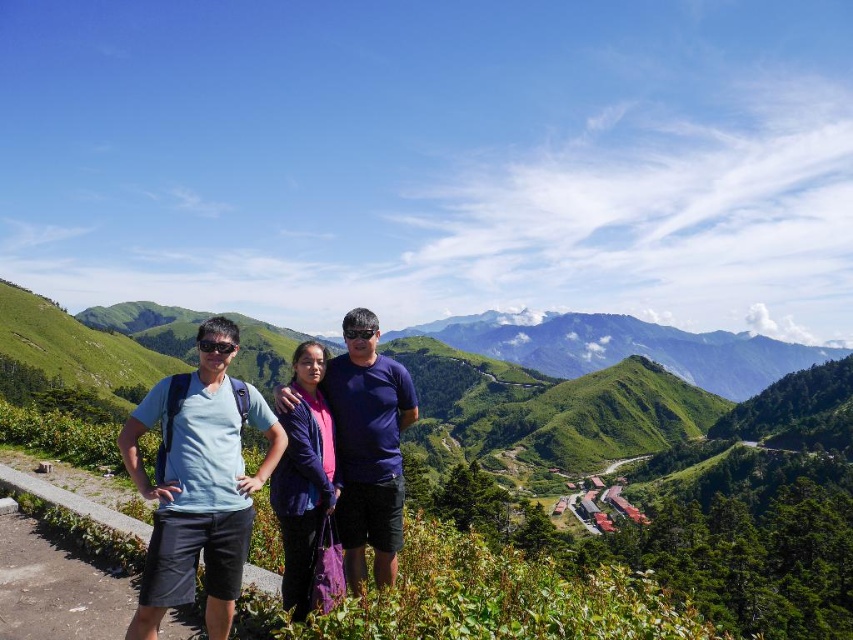
From the picture: Measure the distance between point (346, 454) and camera.

They are 23.25 meters apart.

Is point (334, 396) positioned behind point (305, 364)?

Yes, point (334, 396) is behind point (305, 364).

Where is `purple matte shirt at center`? This screenshot has width=853, height=640. purple matte shirt at center is located at coordinates (368, 448).

Does point (282, 420) lie behind point (312, 544)?

Yes, point (282, 420) is farther from viewer.

Consider the image. Does matte blue shirt at center have a larger size compared to purple fabric at center?

Indeed, matte blue shirt at center has a larger size compared to purple fabric at center.

The height and width of the screenshot is (640, 853). I want to click on matte blue shirt at center, so click(200, 484).

Is matte blue shirt at center taller than purple matte shirt at center?

Incorrect, matte blue shirt at center's height is not larger of purple matte shirt at center's.

Can you confirm if matte blue shirt at center is positioned to the left of purple matte shirt at center?

Correct, you'll find matte blue shirt at center to the left of purple matte shirt at center.

This screenshot has height=640, width=853. I want to click on matte blue shirt at center, so tap(200, 484).